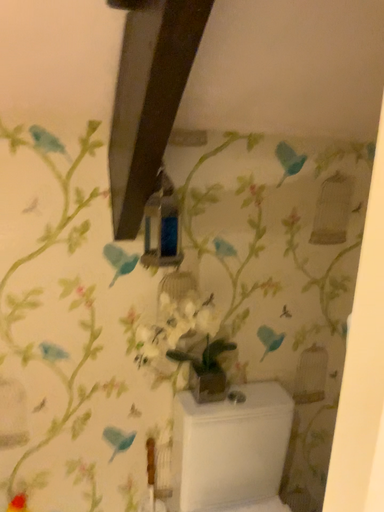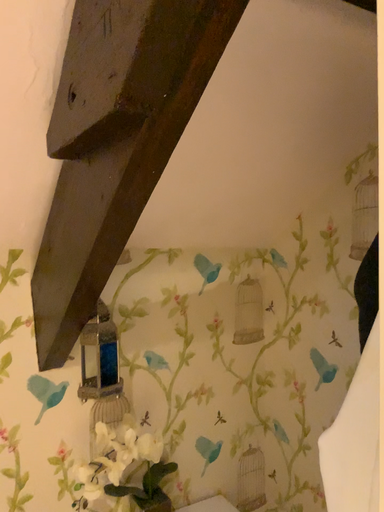
Question: Which way did the camera rotate in the video?

Choices:
 (A) rotated right
 (B) rotated left

Answer: (A)